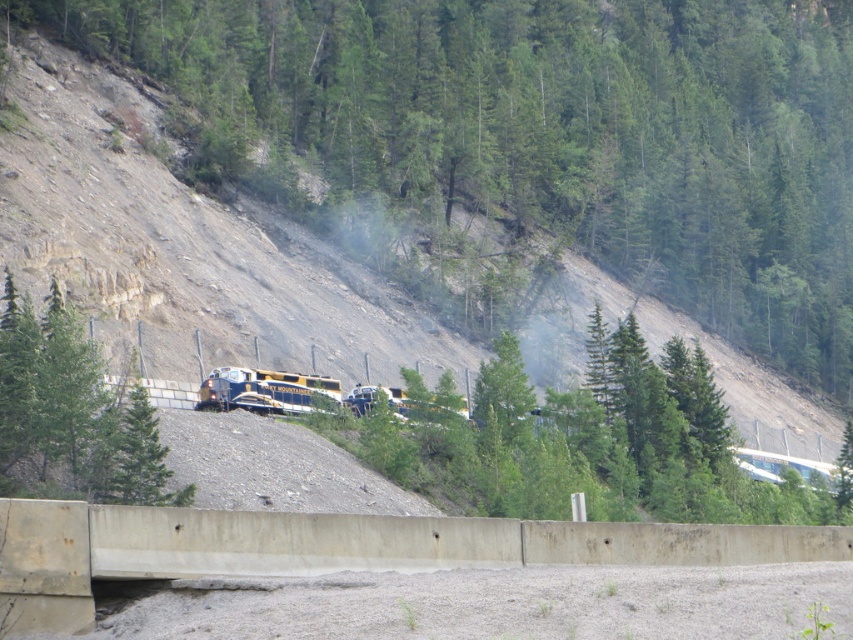
Between green leafy tree at center and yellow and blue painted locomotive at center, which one has more height?

green leafy tree at center

Is green leafy tree at center behind yellow and blue painted locomotive at center?

Yes, green leafy tree at center is further from the viewer.

Is point (152, 12) behind point (289, 396)?

Yes, it is behind point (289, 396).

I want to click on green leafy tree at center, so click(554, 129).

Between point (65, 312) and point (248, 380), which one is positioned behind?

Point (248, 380)

Does green matte tree at center appear on the left side of yellow and blue painted locomotive at center?

Indeed, green matte tree at center is positioned on the left side of yellow and blue painted locomotive at center.

Locate an element on the screen. green matte tree at center is located at coordinates (73, 413).

Describe the element at coordinates (554, 129) in the screenshot. This screenshot has width=853, height=640. I see `green leafy tree at center` at that location.

Image resolution: width=853 pixels, height=640 pixels. In order to click on green leafy tree at center in this screenshot , I will do `click(554, 129)`.

I want to click on green leafy tree at center, so click(x=554, y=129).